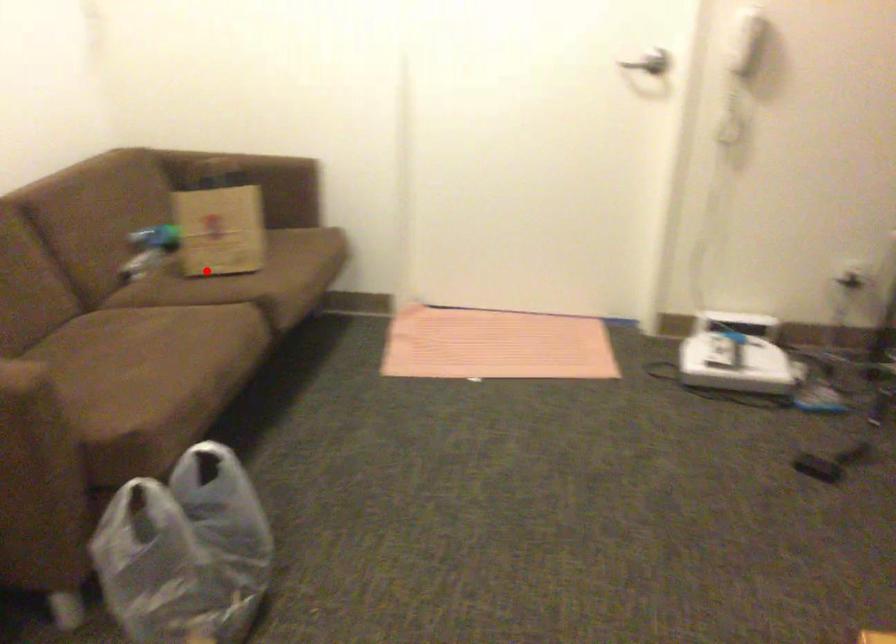
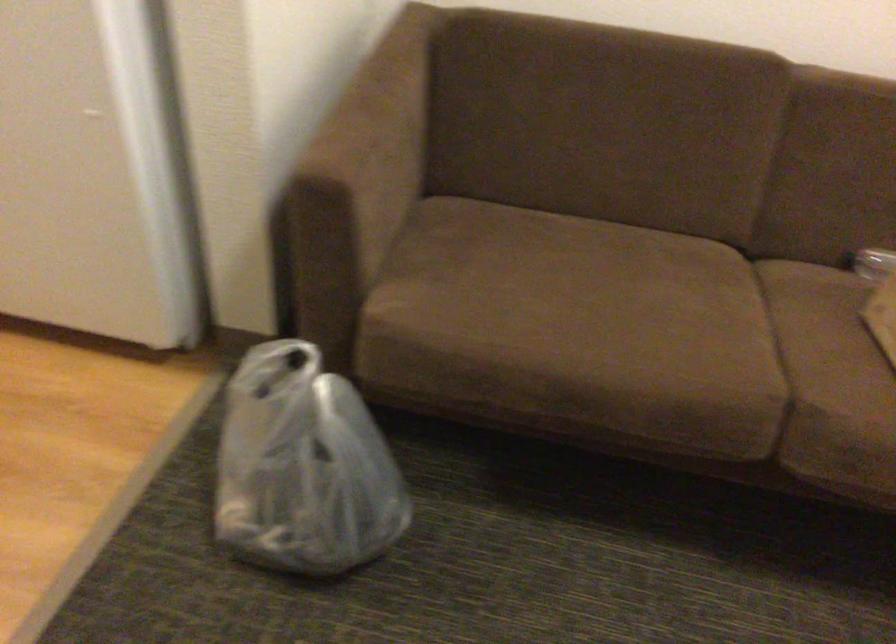
Question: I am providing you with two images of the same scene from different viewpoints. In image1, a red point is highlighted. Considering the same 3D point in image2, which of the following is correct?

Choices:
 (A) It is closer
 (B) It is farther

Answer: (A)